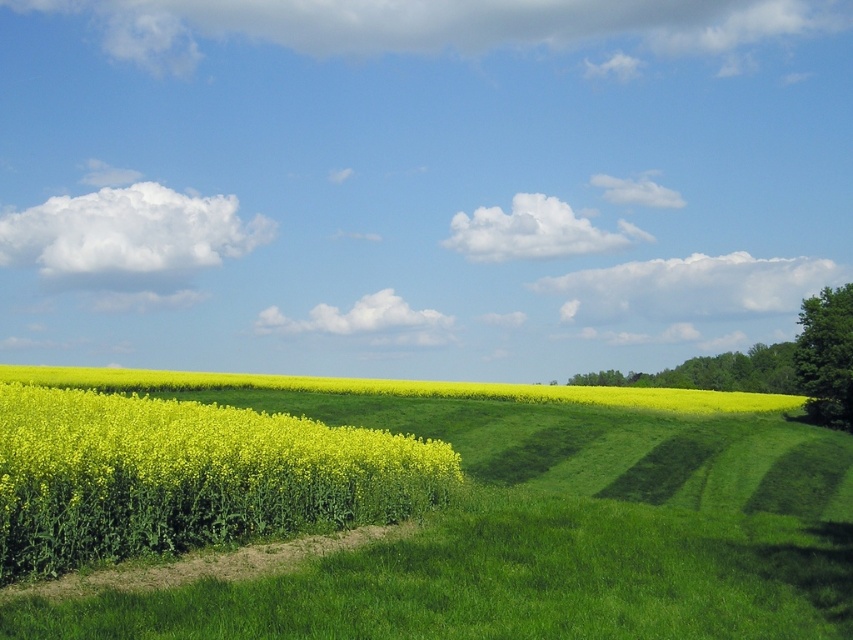
Consider the image. You are standing in the middle of the yellow flower field and want to walk towards the green leafy tree at right. However, there is another green leafy tree at upper right in your path. Which tree will you encounter first?

You will encounter the green leafy tree at upper right first because it is closer to your current position in the middle of the field compared to the green leafy tree at right, which is positioned further away.